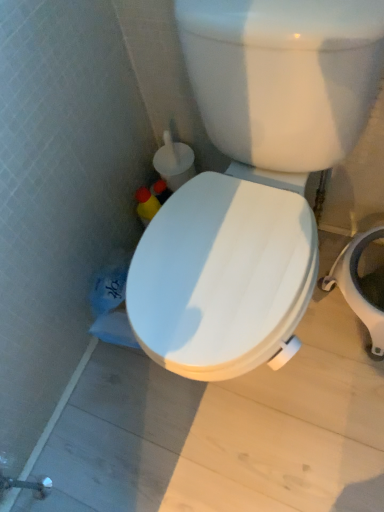
Question: From the image's perspective, is white glossy toilet seat at center located above white plastic bidet at right?

Choices:
 (A) yes
 (B) no

Answer: (A)

Question: Is white glossy toilet seat at center taller than white plastic bidet at right?

Choices:
 (A) no
 (B) yes

Answer: (B)

Question: Considering the relative positions of white glossy toilet seat at center and white plastic bidet at right in the image provided, is white glossy toilet seat at center behind white plastic bidet at right?

Choices:
 (A) no
 (B) yes

Answer: (A)

Question: Does white glossy toilet seat at center lie in front of white plastic bidet at right?

Choices:
 (A) no
 (B) yes

Answer: (B)

Question: Can you confirm if white glossy toilet seat at center is wider than white plastic bidet at right?

Choices:
 (A) no
 (B) yes

Answer: (B)

Question: Does white glossy toilet seat at center have a lesser width compared to white plastic bidet at right?

Choices:
 (A) yes
 (B) no

Answer: (B)

Question: Does white plastic bidet at right have a lesser height compared to white glossy toilet seat at center?

Choices:
 (A) yes
 (B) no

Answer: (A)

Question: From a real-world perspective, is white plastic bidet at right on white glossy toilet seat at center?

Choices:
 (A) no
 (B) yes

Answer: (A)

Question: Can you confirm if white plastic bidet at right is smaller than white glossy toilet seat at center?

Choices:
 (A) no
 (B) yes

Answer: (B)

Question: Is white plastic bidet at right beside white glossy toilet seat at center?

Choices:
 (A) yes
 (B) no

Answer: (B)

Question: Considering the relative positions of white plastic bidet at right and white glossy toilet seat at center in the image provided, is white plastic bidet at right in front of white glossy toilet seat at center?

Choices:
 (A) no
 (B) yes

Answer: (A)

Question: Considering the relative sizes of white plastic bidet at right and white glossy toilet seat at center in the image provided, is white plastic bidet at right taller than white glossy toilet seat at center?

Choices:
 (A) yes
 (B) no

Answer: (B)

Question: Considering the positions of white glossy toilet seat at center and white plastic bidet at right in the image, is white glossy toilet seat at center taller or shorter than white plastic bidet at right?

Choices:
 (A) short
 (B) tall

Answer: (B)